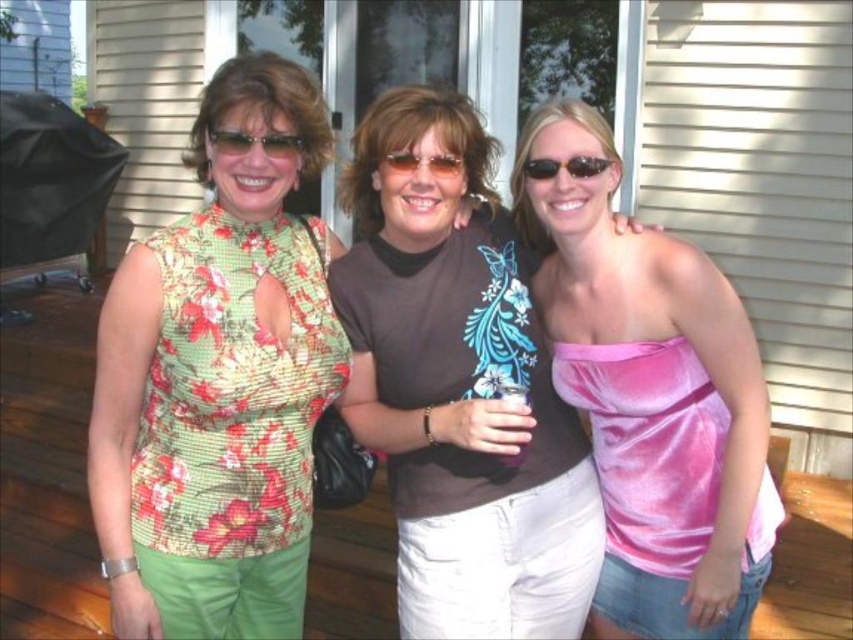
You are standing on the deck and want to place a small potted plant between the two points, point (611, 524) and point (210, 141). Which point should the plant be closer to so it appears closer to you?

The plant should be closer to point (611, 524) because it is further to the viewer than point (210, 141).

You are standing at the point marked as point (587, 154) and want to walk towards the house. Is the house behind you or in front of you?

The house is behind you because the point (587, 154) is 6.77 feet away from the viewer, meaning the viewer is facing away from the house towards the women.